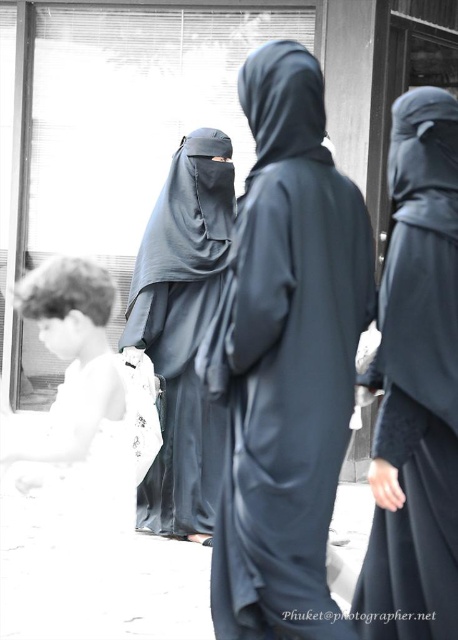
Is point (121, 161) in front of point (205, 520)?

No.

Locate an element on the screen. transparent glass shop window at center is located at coordinates [x=130, y=115].

You are a GUI agent. You are given a task and a screenshot of the screen. Output one action in this format:
    pyautogui.click(x=<x>, y=<y>)
    Task: Click on the transparent glass shop window at center
    Image resolution: width=458 pixels, height=640 pixels.
    Given the screenshot: What is the action you would take?
    pyautogui.click(x=130, y=115)

Is transparent glass shop window at center smaller than matte black robe at right?

Incorrect, transparent glass shop window at center is not smaller in size than matte black robe at right.

Does transparent glass shop window at center have a greater height compared to matte black robe at right?

Yes.

You are a GUI agent. You are given a task and a screenshot of the screen. Output one action in this format:
    pyautogui.click(x=<x>, y=<y>)
    Task: Click on the transparent glass shop window at center
    The width and height of the screenshot is (458, 640).
    Given the screenshot: What is the action you would take?
    pyautogui.click(x=130, y=115)

Image resolution: width=458 pixels, height=640 pixels. I want to click on transparent glass shop window at center, so click(x=130, y=115).

Is black matte niqab at center above transparent glass shop window at center?

Actually, black matte niqab at center is below transparent glass shop window at center.

Is point (233, 388) behind point (148, 29)?

No, it is not.

Locate an element on the screen. The image size is (458, 640). black matte niqab at center is located at coordinates (x=285, y=358).